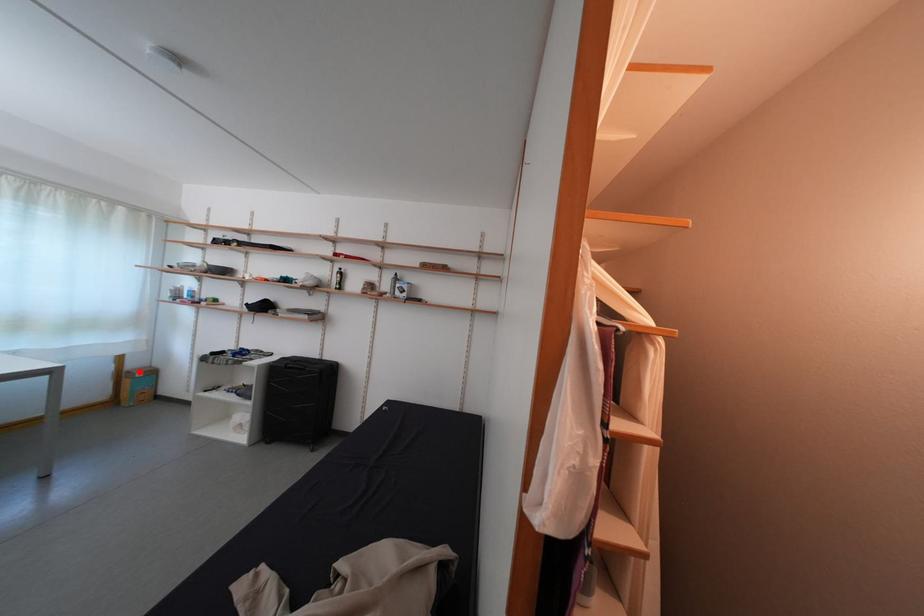
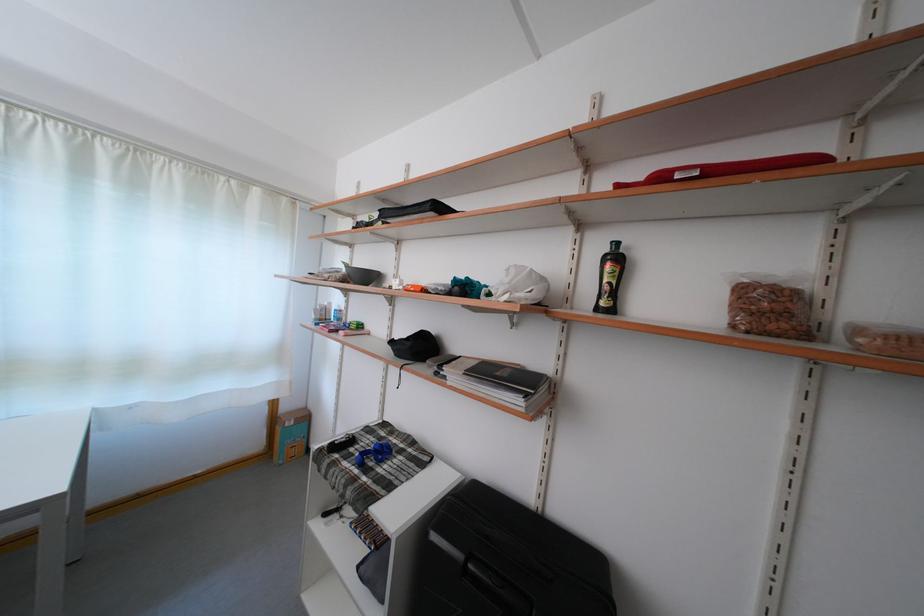
In the second image, find the point that corresponds to the highlighted location in the first image.

(293, 415)